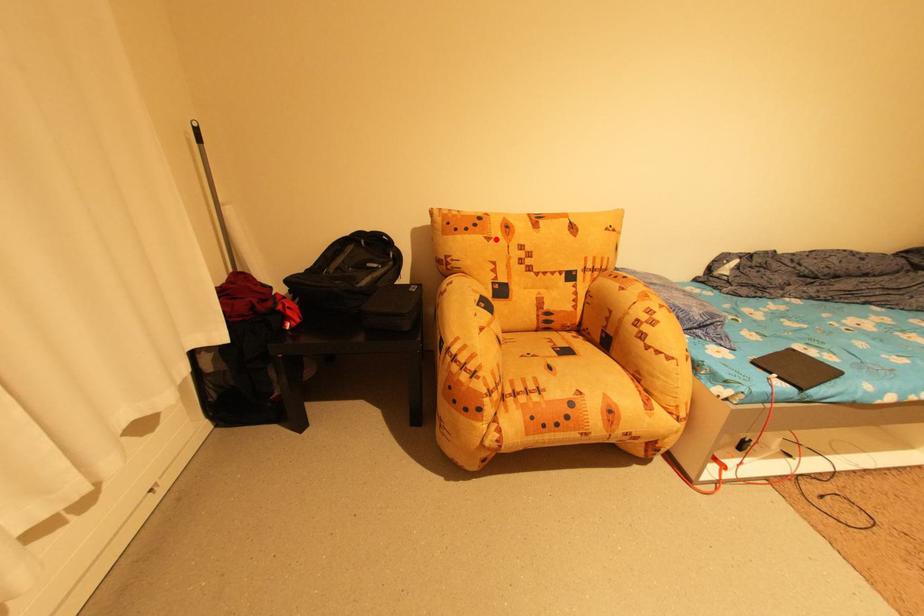
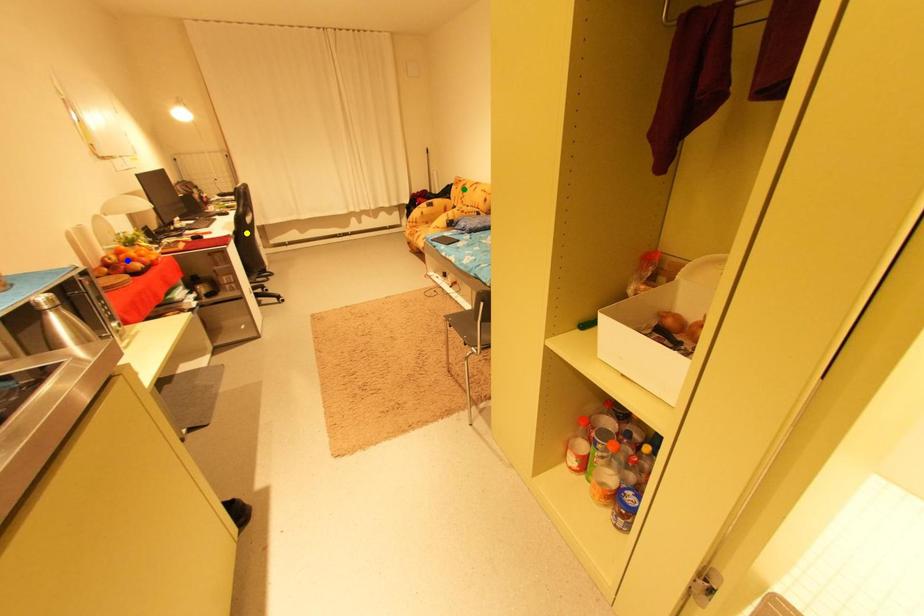
Question: I am providing you with two images of the same scene from different viewpoints. A red point is marked on the first image. You are given multiple points on the second image. Which point in image 2 is actually the same real-world point as the red point in image 1?

Choices:
 (A) blue point
 (B) green point
 (C) yellow point

Answer: (B)